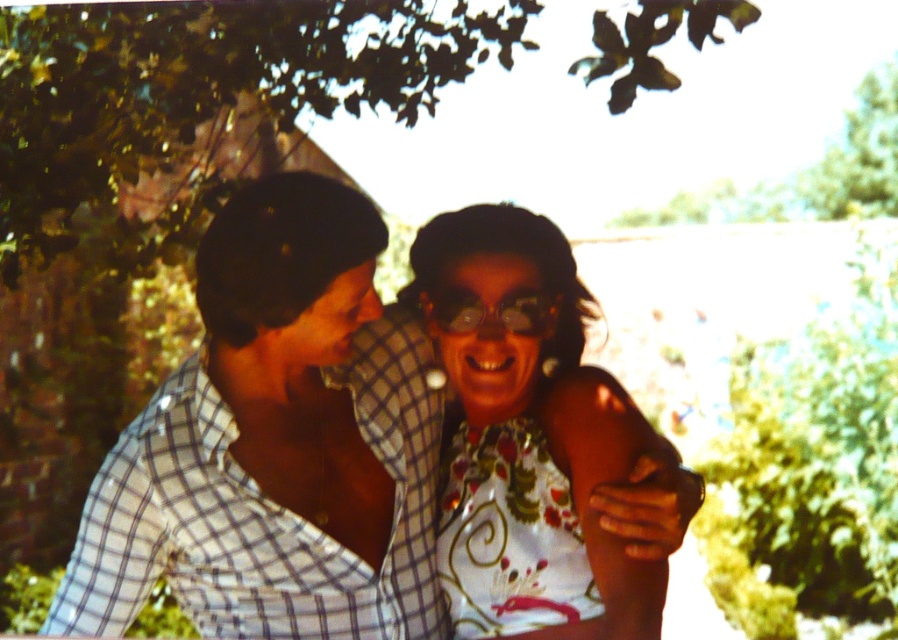
Question: Is green leafy tree at upper center smaller than white floral dress at center?

Choices:
 (A) no
 (B) yes

Answer: (A)

Question: Which object appears farthest from the camera in this image?

Choices:
 (A) green leafy tree at upper center
 (B) white floral dress at center
 (C) transparent plastic goggles at center

Answer: (A)

Question: Estimate the real-world distances between objects in this image. Which object is farther from the green leafy tree at upper center?

Choices:
 (A) checkered fabric shirt at left
 (B) white checkered shirt at center
 (C) white floral dress at center
 (D) transparent plastic goggles at center

Answer: (D)

Question: Does white checkered shirt at center have a smaller size compared to green leafy tree at upper center?

Choices:
 (A) yes
 (B) no

Answer: (A)

Question: Which point is farther to the camera?

Choices:
 (A) transparent plastic goggles at center
 (B) white floral dress at center

Answer: (A)

Question: Does green leafy tree at upper center have a lesser width compared to transparent plastic goggles at center?

Choices:
 (A) yes
 (B) no

Answer: (B)